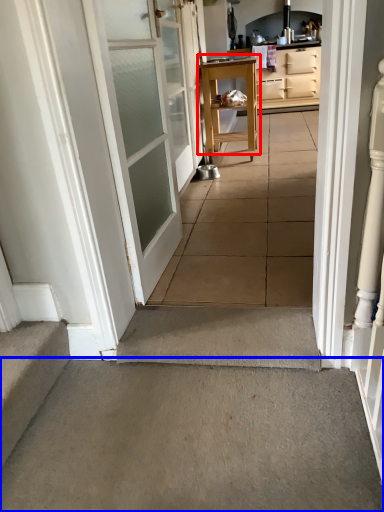
Question: Which of the following is the closest to the observer, table (highlighted by a red box) or concrete (highlighted by a blue box)?

Choices:
 (A) table
 (B) concrete

Answer: (B)